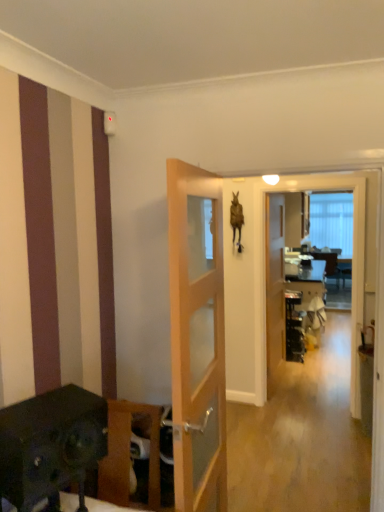
Question: Based on their positions, is transparent glass screen door at center located to the left or right of wooden cabinet at lower left?

Choices:
 (A) right
 (B) left

Answer: (A)

Question: From the image's perspective, is transparent glass screen door at center positioned above or below wooden cabinet at lower left?

Choices:
 (A) below
 (B) above

Answer: (B)

Question: Which object is the farthest from the light wood/glass door at center, which appears as the second door when viewed from the back?

Choices:
 (A) transparent glass screen door at center
 (B) wooden door at center, the 1th door positioned from the right
 (C) wooden cabinet at lower left

Answer: (B)

Question: Which object is the farthest from the wooden cabinet at lower left?

Choices:
 (A) wooden door at center, positioned as the 2th door in front-to-back order
 (B) transparent glass screen door at center
 (C) light wood/glass door at center, the 1th door when ordered from front to back

Answer: (A)